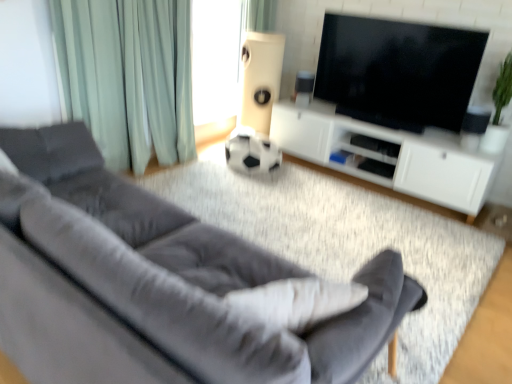
Measure the distance between point (78, 21) and camera.

They are 2.63 meters apart.

Describe the element at coordinates (398, 71) in the screenshot. This screenshot has height=384, width=512. I see `black glossy tv at upper center` at that location.

How much space does white matte speaker at center, which is counted as the first speaker, starting from the left, occupy vertically?

white matte speaker at center, which is counted as the first speaker, starting from the left, is 3.39 feet tall.

Describe the element at coordinates (389, 155) in the screenshot. This screenshot has width=512, height=384. I see `white matte cabinet at center` at that location.

In order to face velvet gray couch at lower left, should I rotate leftwards or rightwards?

A 17.332 degree turn to the left will do.

Where is `green fabric curtain at left, the 2th curtain in the back-to-front sequence`? The image size is (512, 384). green fabric curtain at left, the 2th curtain in the back-to-front sequence is located at coordinates (128, 76).

Is white plastic speaker at upper center, which is the 2th speaker from left to right, not near green fabric curtain at upper center, arranged as the 1th curtain when viewed from the right?

No, there isn't a large distance between white plastic speaker at upper center, which is the 2th speaker from left to right, and green fabric curtain at upper center, arranged as the 1th curtain when viewed from the right.

Does white plastic speaker at upper center, arranged as the first speaker when viewed from the right, have a lesser height compared to green fabric curtain at upper center, arranged as the 1th curtain when viewed from the right?

Correct, white plastic speaker at upper center, arranged as the first speaker when viewed from the right, is not as tall as green fabric curtain at upper center, arranged as the 1th curtain when viewed from the right.

From a real-world perspective, is white plastic speaker at upper center, arranged as the first speaker when viewed from the right, positioned over green fabric curtain at upper center, the first curtain from the back, based on gravity?

No, from a real-world perspective, white plastic speaker at upper center, arranged as the first speaker when viewed from the right, is not on top of green fabric curtain at upper center, the first curtain from the back.

Can you tell me how much white plastic speaker at upper center, arranged as the first speaker when viewed from the right, and green fabric curtain at upper center, the first curtain from the back, differ in facing direction?

They differ by 90 degrees in their facing directions.

Considering their positions, is white matte speaker at center, which is counted as the first speaker, starting from the left, located in front of or behind green fabric curtain at upper center, acting as the second curtain starting from the left?

white matte speaker at center, which is counted as the first speaker, starting from the left, is positioned closer to the viewer than green fabric curtain at upper center, acting as the second curtain starting from the left.

Between white matte speaker at center, marked as the second speaker in a right-to-left arrangement, and green fabric curtain at upper center, acting as the second curtain starting from the left, which one has smaller size?

Smaller between the two is green fabric curtain at upper center, acting as the second curtain starting from the left.

From the image's perspective, is white matte speaker at center, which is counted as the first speaker, starting from the left, located above or below green fabric curtain at upper center, the first curtain from the back?

Clearly, from the image's perspective, white matte speaker at center, which is counted as the first speaker, starting from the left, is below green fabric curtain at upper center, the first curtain from the back.

Does point (93, 72) come in front of point (304, 371)?

That is False.

Considering the relative positions of green fabric curtain at left, the first curtain positioned from the left, and velvet gray couch at lower left in the image provided, is green fabric curtain at left, the first curtain positioned from the left, to the right of velvet gray couch at lower left from the viewer's perspective?

In fact, green fabric curtain at left, the first curtain positioned from the left, is to the left of velvet gray couch at lower left.

From the image's perspective, is green fabric curtain at left, the second curtain from the right, below velvet gray couch at lower left?

No, from the image's perspective, green fabric curtain at left, the second curtain from the right, is not below velvet gray couch at lower left.

Is white matte cabinet at center turned away from green fabric curtain at upper center, the first curtain from the back?

white matte cabinet at center is not turned away from green fabric curtain at upper center, the first curtain from the back.

From a real-world perspective, who is located higher, white matte cabinet at center or green fabric curtain at upper center, acting as the second curtain starting from the left?

In real-world perspective, green fabric curtain at upper center, acting as the second curtain starting from the left, is above.

Can you see white matte cabinet at center touching green fabric curtain at upper center, acting as the second curtain starting from the left?

No, white matte cabinet at center is not with green fabric curtain at upper center, acting as the second curtain starting from the left.

Does white matte cabinet at center have a greater height compared to green fabric curtain at upper center, arranged as the 1th curtain when viewed from the right?

Incorrect, the height of white matte cabinet at center is not larger of that of green fabric curtain at upper center, arranged as the 1th curtain when viewed from the right.

Is green fabric curtain at left, the second curtain from the right, facing away from black glossy tv at upper center?

No, green fabric curtain at left, the second curtain from the right, is not facing away from black glossy tv at upper center.

You are a GUI agent. You are given a task and a screenshot of the screen. Output one action in this format:
    pyautogui.click(x=<x>, y=<y>)
    Task: Click on the television located behind the green fabric curtain at left, which appears as the second curtain when viewed from the top
    
    Given the screenshot: What is the action you would take?
    pyautogui.click(x=398, y=71)

From the image's perspective, relative to black glossy tv at upper center, is green fabric curtain at left, which appears as the second curtain when viewed from the top, above or below?

green fabric curtain at left, which appears as the second curtain when viewed from the top, is situated lower than black glossy tv at upper center in the image.

How many degrees apart are the facing directions of green fabric curtain at left, which appears as the second curtain when viewed from the top, and black glossy tv at upper center?

90.3 degrees separate the facing orientations of green fabric curtain at left, which appears as the second curtain when viewed from the top, and black glossy tv at upper center.

How far apart are green fabric curtain at left, which ranks as the 1th curtain in bottom-to-top order, and white matte speaker at center, marked as the second speaker in a right-to-left arrangement?

green fabric curtain at left, which ranks as the 1th curtain in bottom-to-top order, is 1.02 meters away from white matte speaker at center, marked as the second speaker in a right-to-left arrangement.

Which of these two, green fabric curtain at left, the first curtain when ordered from front to back, or white matte speaker at center, which is counted as the first speaker, starting from the left, is bigger?

Bigger between the two is green fabric curtain at left, the first curtain when ordered from front to back.

Is green fabric curtain at left, the second curtain from the right, inside or outside of white matte speaker at center, marked as the second speaker in a right-to-left arrangement?

green fabric curtain at left, the second curtain from the right, is spatially situated outside white matte speaker at center, marked as the second speaker in a right-to-left arrangement.

Where is `the 1st curtain directly above the white matte speaker at center, marked as the second speaker in a right-to-left arrangement (from a real-world perspective)`? Image resolution: width=512 pixels, height=384 pixels. the 1st curtain directly above the white matte speaker at center, marked as the second speaker in a right-to-left arrangement (from a real-world perspective) is located at coordinates (128, 76).

Looking at this image, can you tell me how much velvet gray couch at lower left and white matte cabinet at center differ in facing direction?

velvet gray couch at lower left and white matte cabinet at center are facing 180 degrees away from each other.

Which of these two, velvet gray couch at lower left or white matte cabinet at center, is wider?

velvet gray couch at lower left is wider.

From the picture: From the image's perspective, which one is positioned lower, velvet gray couch at lower left or white matte cabinet at center?

velvet gray couch at lower left, from the image's perspective.

Considering the sizes of objects velvet gray couch at lower left and white matte cabinet at center in the image provided, who is shorter, velvet gray couch at lower left or white matte cabinet at center?

With less height is white matte cabinet at center.

Find the location of a particular element. The height and width of the screenshot is (384, 512). speaker that is the 2nd one when counting forward from the green fabric curtain at upper center, acting as the second curtain starting from the left is located at coordinates (304, 88).

Find the location of `curtain that is the 2nd one above the white matte speaker at center, marked as the second speaker in a right-to-left arrangement (from a real-world perspective)`. curtain that is the 2nd one above the white matte speaker at center, marked as the second speaker in a right-to-left arrangement (from a real-world perspective) is located at coordinates (260, 15).

In the scene shown: When comparing their distances from black glossy tv at upper center, does white matte cabinet at center or white plastic speaker at upper center, which is the 2th speaker from left to right, seem closer?

white matte cabinet at center is positioned closer to the anchor black glossy tv at upper center.

Estimate the real-world distances between objects in this image. Which object is closer to white matte speaker at center, marked as the second speaker in a right-to-left arrangement, green fabric curtain at upper center, arranged as the 1th curtain when viewed from the right, or white plastic speaker at upper center, arranged as the first speaker when viewed from the right?

white plastic speaker at upper center, arranged as the first speaker when viewed from the right, lies closer to white matte speaker at center, marked as the second speaker in a right-to-left arrangement, than the other object.

From the image, which object appears to be farther from white matte speaker at center, marked as the second speaker in a right-to-left arrangement, white matte cabinet at center or velvet gray couch at lower left?

velvet gray couch at lower left.

Looking at the image, which one is located closer to green fabric curtain at upper center, the first curtain from the back, white matte cabinet at center or white plastic speaker at upper center, arranged as the first speaker when viewed from the right?

Among the two, white plastic speaker at upper center, arranged as the first speaker when viewed from the right, is located nearer to green fabric curtain at upper center, the first curtain from the back.

Which object lies nearer to the anchor point white plastic speaker at upper center, which is the 2th speaker from left to right, velvet gray couch at lower left or green fabric curtain at upper center, the second curtain viewed from the front?

green fabric curtain at upper center, the second curtain viewed from the front, is closer to white plastic speaker at upper center, which is the 2th speaker from left to right.

Based on their spatial positions, is green fabric curtain at upper center, acting as the second curtain starting from the left, or white matte speaker at center, marked as the second speaker in a right-to-left arrangement, further from white matte cabinet at center?

green fabric curtain at upper center, acting as the second curtain starting from the left, is positioned further to the anchor white matte cabinet at center.

Based on their spatial positions, is white matte cabinet at center or white matte speaker at center, which is counted as the first speaker, starting from the left, further from green fabric curtain at left, the 2th curtain in the back-to-front sequence?

Among the two, white matte cabinet at center is located further to green fabric curtain at left, the 2th curtain in the back-to-front sequence.

Estimate the real-world distances between objects in this image. Which object is further from black glossy tv at upper center, white plastic speaker at upper center, arranged as the first speaker when viewed from the right, or green fabric curtain at left, the first curtain positioned from the left?

Among the two, green fabric curtain at left, the first curtain positioned from the left, is located further to black glossy tv at upper center.

Find the location of `cabinetry situated between green fabric curtain at left, which ranks as the 1th curtain in bottom-to-top order, and black glossy tv at upper center from left to right`. cabinetry situated between green fabric curtain at left, which ranks as the 1th curtain in bottom-to-top order, and black glossy tv at upper center from left to right is located at coordinates (389, 155).

Where is `speaker situated between green fabric curtain at left, the 2th curtain in the back-to-front sequence, and white plastic speaker at upper center, arranged as the first speaker when viewed from the right, from left to right`? speaker situated between green fabric curtain at left, the 2th curtain in the back-to-front sequence, and white plastic speaker at upper center, arranged as the first speaker when viewed from the right, from left to right is located at coordinates (260, 79).

Find the location of a particular element. The width and height of the screenshot is (512, 384). curtain between velvet gray couch at lower left and green fabric curtain at upper center, acting as the second curtain starting from the left, from front to back is located at coordinates (128, 76).

At what (x,y) coordinates should I click in order to perform the action: click on cabinetry located between velvet gray couch at lower left and white matte speaker at center, which is counted as the first speaker, starting from the left, in the depth direction. Please return your answer as a coordinate pair (x, y). Looking at the image, I should click on (389, 155).